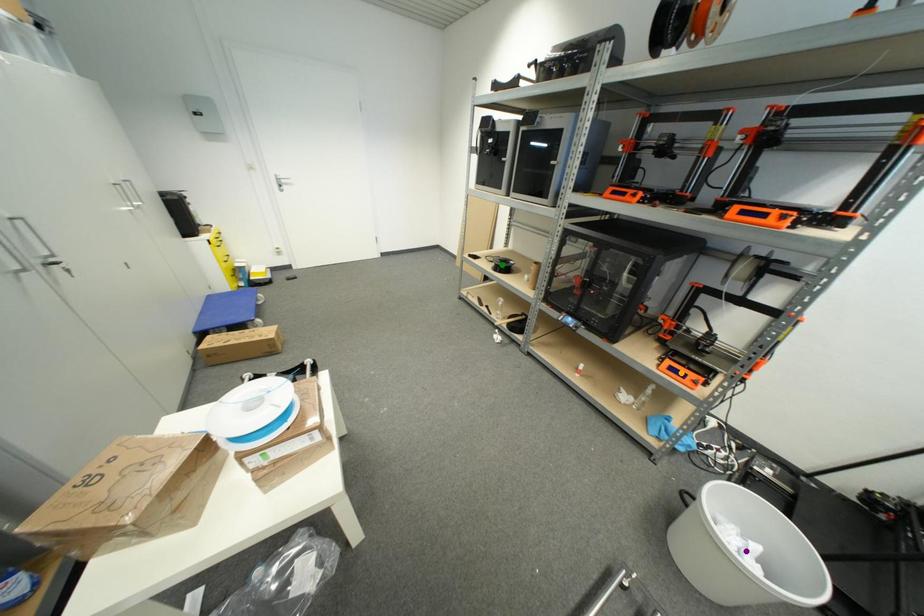
Order these from farthest to nearest:
A) orange point
B) green point
C) purple point

green point, orange point, purple point